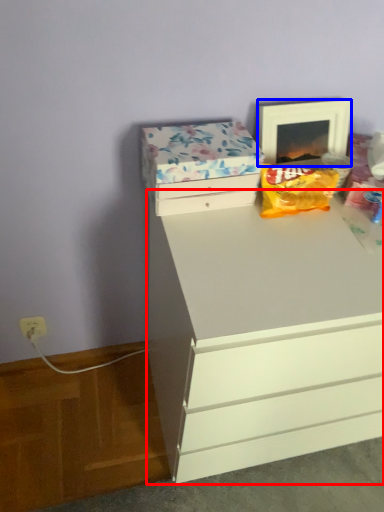
Question: Which of the following is the farthest to the observer, chest of drawers (highlighted by a red box) or picture frame (highlighted by a blue box)?

Choices:
 (A) chest of drawers
 (B) picture frame

Answer: (B)